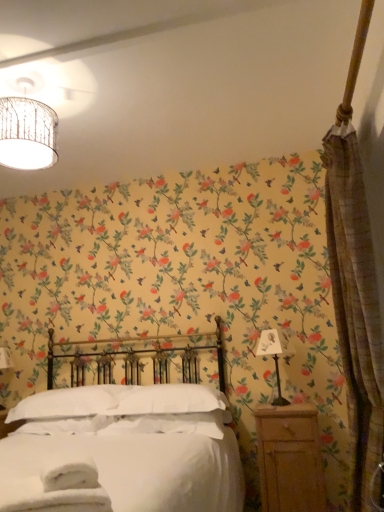
Question: Considering the positions of white soft pillow at center, the first pillow when ordered from right to left, and metallic silver lamp at right in the image, is white soft pillow at center, the first pillow when ordered from right to left, wider or thinner than metallic silver lamp at right?

Choices:
 (A) wide
 (B) thin

Answer: (A)

Question: Does point (185, 403) appear closer or farther from the camera than point (269, 349)?

Choices:
 (A) farther
 (B) closer

Answer: (B)

Question: Based on their relative distances, which object is farther from the white soft pillow at center, the first pillow when ordered from right to left?

Choices:
 (A) textured beige curtain at right
 (B) metallic silver lamp at right
 (C) white matte bed at center
 (D) white soft pillow at center, positioned as the 1th pillow in left-to-right order
 (E) wooden nightstand at lower right

Answer: (A)

Question: Which of these objects is positioned closest to the textured beige curtain at right?

Choices:
 (A) matte woven lampshade at upper left
 (B) metallic silver lamp at right
 (C) wooden nightstand at lower right
 (D) white matte bed at center
 (E) white soft pillow at center, which is counted as the 2th pillow, starting from the left

Answer: (C)